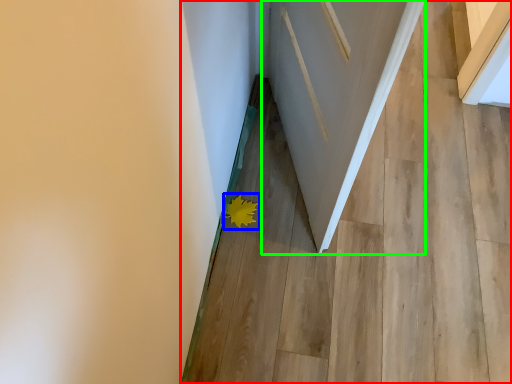
Question: Which object is the farthest from stairwell (highlighted by a red box)? Choose among these: flower (highlighted by a blue box) or door (highlighted by a green box).

Choices:
 (A) flower
 (B) door

Answer: (A)